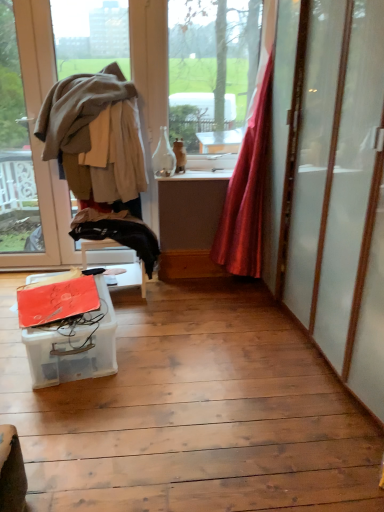
Question: Looking at their shapes, would you say translucent plastic container at lower left is wider or thinner than light brown fabric at left?

Choices:
 (A) thin
 (B) wide

Answer: (B)

Question: Does point (51, 365) appear closer or farther from the camera than point (71, 168)?

Choices:
 (A) farther
 (B) closer

Answer: (B)

Question: Estimate the real-world distances between objects in this image. Which object is farther from the matte beige window at left?

Choices:
 (A) light brown fabric at left
 (B) translucent plastic container at lower left
 (C) silky red curtain at right

Answer: (C)

Question: Which object is the farthest from the light brown fabric at left?

Choices:
 (A) silky red curtain at right
 (B) matte beige window at left
 (C) translucent plastic container at lower left

Answer: (C)